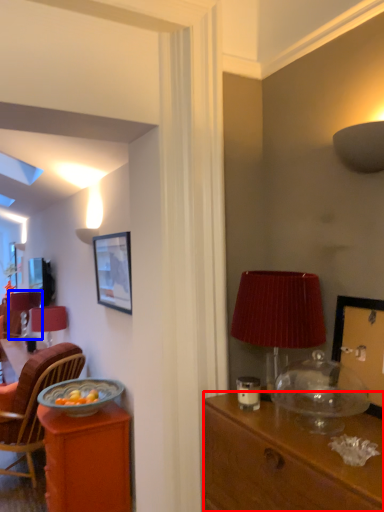
Question: Among these objects, which one is nearest to the camera, desk (highlighted by a red box) or table lamp (highlighted by a blue box)?

Choices:
 (A) desk
 (B) table lamp

Answer: (A)